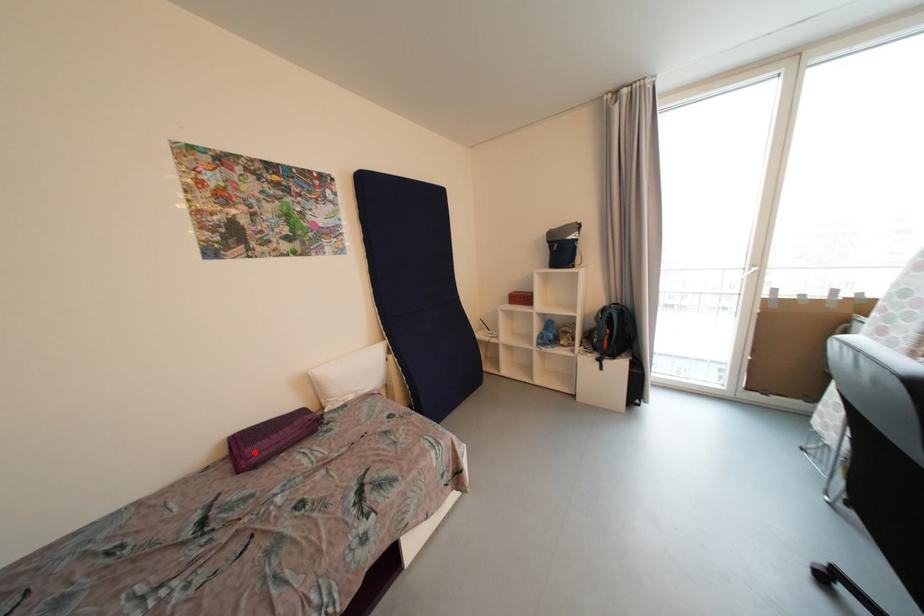
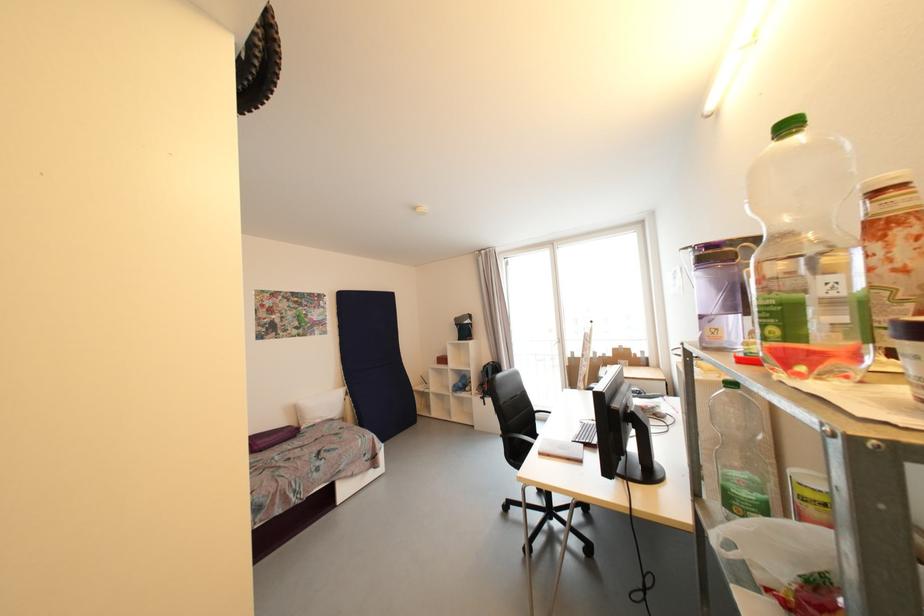
Find the pixel in the second image that matches the highlighted location in the first image.

(263, 445)